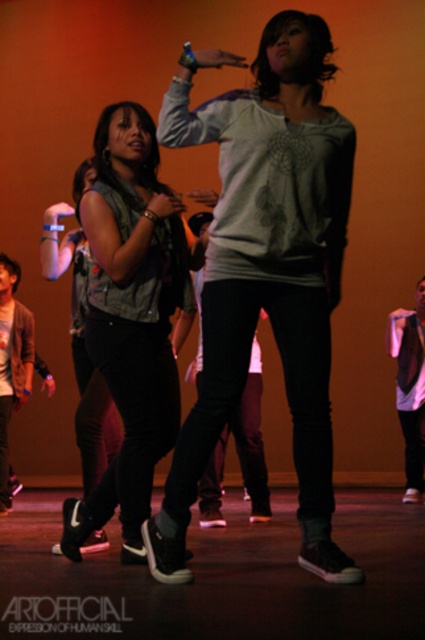
Question: In this image, where is matte gray sweatshirt at center located relative to denim vest at center?

Choices:
 (A) right
 (B) left

Answer: (A)

Question: Is matte gray sweatshirt at center above denim vest at center?

Choices:
 (A) yes
 (B) no

Answer: (A)

Question: Considering the real-world distances, which object is closest to the matte gray sweatshirt at center?

Choices:
 (A) white matte shirt at center
 (B) denim vest at center

Answer: (B)

Question: Which point appears farthest from the camera in this image?

Choices:
 (A) (141, 340)
 (B) (401, 355)
 (C) (204, 125)

Answer: (B)

Question: Does denim vest at center have a larger size compared to white matte shirt at center?

Choices:
 (A) yes
 (B) no

Answer: (A)

Question: Which object appears closest to the camera in this image?

Choices:
 (A) matte gray sweatshirt at center
 (B) denim vest at center

Answer: (A)